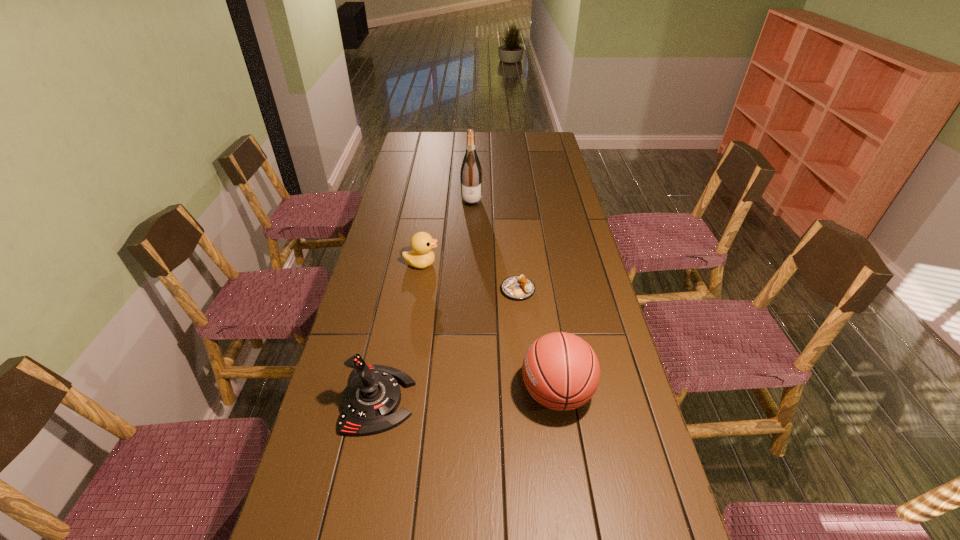
Locate an element on the screen. free space located on the logo side of the basketball is located at coordinates (438, 393).

I want to click on free space located 0.110m on the logo side of the basketball, so click(x=481, y=393).

The width and height of the screenshot is (960, 540). What are the coordinates of `vacant space positioned 0.180m on the handle side of the joystick` in the screenshot? It's located at (480, 400).

Where is `vacant region located on the face of the fourth tallest object`? vacant region located on the face of the fourth tallest object is located at coordinates (468, 264).

This screenshot has height=540, width=960. In order to click on free region located 0.150m on the left of the third nearest object in this screenshot , I will do (458, 290).

In order to click on joystick present at the left edge in this screenshot , I will do `click(370, 400)`.

Find the location of `duck that is at the left edge`. duck that is at the left edge is located at coordinates (422, 256).

This screenshot has height=540, width=960. I want to click on object located at the right edge, so click(x=561, y=371).

Identify the location of vacant space at the far edge of the desktop. The image size is (960, 540). (492, 135).

This screenshot has width=960, height=540. In order to click on free location at the left edge of the desktop in this screenshot , I will do `click(413, 216)`.